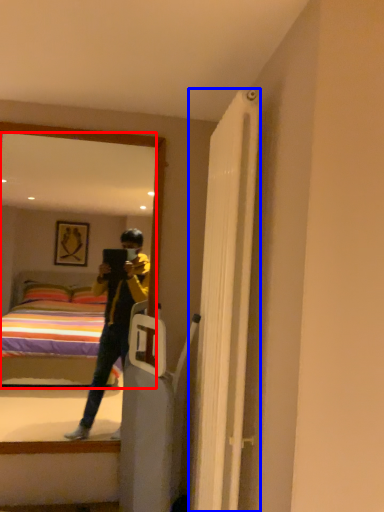
Question: Which object is further to the camera taking this photo, mirror (highlighted by a red box) or door (highlighted by a blue box)?

Choices:
 (A) mirror
 (B) door

Answer: (A)